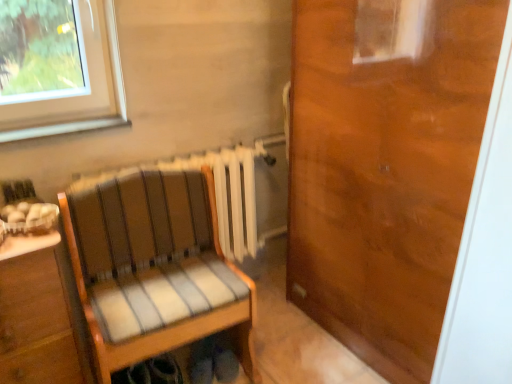
What are the coordinates of `wooden door at right` in the screenshot? It's located at (386, 166).

This screenshot has height=384, width=512. Describe the element at coordinates (386, 166) in the screenshot. I see `wooden door at right` at that location.

The height and width of the screenshot is (384, 512). Describe the element at coordinates (154, 267) in the screenshot. I see `striped fabric chair at center` at that location.

Measure the distance between point (118, 255) and camera.

Point (118, 255) is 5.48 feet away from camera.

This screenshot has height=384, width=512. Identify the location of striped fabric chair at center. (154, 267).

Image resolution: width=512 pixels, height=384 pixels. What are the coordinates of `wooden door at right` in the screenshot? It's located at (386, 166).

Does wooden door at right appear on the right side of striped fabric chair at center?

Indeed, wooden door at right is positioned on the right side of striped fabric chair at center.

Is the position of wooden door at right more distant than that of striped fabric chair at center?

No, the depth of wooden door at right is less than that of striped fabric chair at center.

Considering the points (340, 123) and (211, 189), which point is behind, point (340, 123) or point (211, 189)?

The point (211, 189) is more distant.

From the image's perspective, is wooden door at right above or below striped fabric chair at center?

From the image's perspective, wooden door at right appears above striped fabric chair at center.

From a real-world perspective, is wooden door at right beneath striped fabric chair at center?

No, from a real-world perspective, wooden door at right is not under striped fabric chair at center.

Considering the sizes of objects wooden door at right and striped fabric chair at center in the image provided, who is wider, wooden door at right or striped fabric chair at center?

striped fabric chair at center.

Considering the relative sizes of wooden door at right and striped fabric chair at center in the image provided, is wooden door at right shorter than striped fabric chair at center?

No.

Does wooden door at right have a smaller size compared to striped fabric chair at center?

Incorrect, wooden door at right is not smaller in size than striped fabric chair at center.

Is wooden door at right completely or partially outside of striped fabric chair at center?

Yes.

Are wooden door at right and striped fabric chair at center beside each other?

wooden door at right and striped fabric chair at center are clearly separated.

Is striped fabric chair at center at the back of wooden door at right?

That's not correct — wooden door at right is not looking away from striped fabric chair at center.

Measure the distance from wooden door at right to striped fabric chair at center.

wooden door at right and striped fabric chair at center are 25.72 inches apart.

Locate an element on the screen. Image resolution: width=512 pixels, height=384 pixels. chair that appears behind the wooden door at right is located at coordinates (154, 267).

Which object is positioned more to the left, striped fabric chair at center or wooden door at right?

From the viewer's perspective, striped fabric chair at center appears more on the left side.

Is striped fabric chair at center in front of wooden door at right?

No.

Consider the image. Which is closer, [96,232] or [385,159]?

The point [385,159] is in front.

From the image's perspective, between striped fabric chair at center and wooden door at right, who is located below?

striped fabric chair at center, from the image's perspective.

From a real-world perspective, between striped fabric chair at center and wooden door at right, who is vertically higher?

wooden door at right, from a real-world perspective.

Considering the sizes of objects striped fabric chair at center and wooden door at right in the image provided, who is wider, striped fabric chair at center or wooden door at right?

striped fabric chair at center is wider.

Between striped fabric chair at center and wooden door at right, which one has more height?

wooden door at right.

Is striped fabric chair at center bigger or smaller than wooden door at right?

In the image, striped fabric chair at center appears to be smaller than wooden door at right.

Would you say striped fabric chair at center contains wooden door at right?

That's incorrect, wooden door at right is not inside striped fabric chair at center.

Are striped fabric chair at center and wooden door at right far apart?

No, there isn't a large distance between striped fabric chair at center and wooden door at right.

Is striped fabric chair at center positioned with its back to wooden door at right?

striped fabric chair at center is not turned away from wooden door at right.

The width and height of the screenshot is (512, 384). Identify the location of chair that is under the wooden door at right (from a real-world perspective). (154, 267).

Locate an element on the screen. This screenshot has height=384, width=512. chair below the wooden door at right (from a real-world perspective) is located at coordinates (154, 267).

At what (x,y) coordinates should I click in order to perform the action: click on chair behind the wooden door at right. Please return your answer as a coordinate pair (x, y). Looking at the image, I should click on (154, 267).